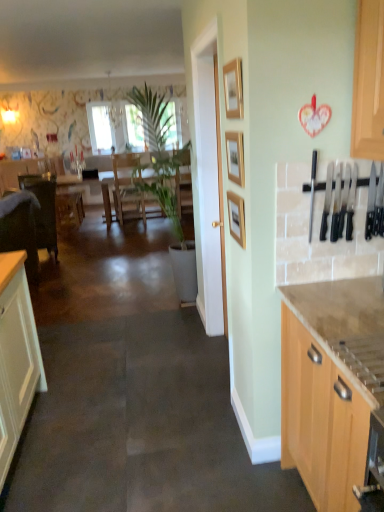
Question: Can you confirm if light wood cabinet at right is wider than wooden picture frame at center, positioned as the third picture frame in top-to-bottom order?

Choices:
 (A) no
 (B) yes

Answer: (B)

Question: Is wooden picture frame at center, the first picture frame ordered from the bottom, at the back of light wood cabinet at right?

Choices:
 (A) no
 (B) yes

Answer: (A)

Question: Is light wood cabinet at right at the right side of wooden picture frame at center, the first picture frame ordered from the bottom?

Choices:
 (A) no
 (B) yes

Answer: (B)

Question: Does light wood cabinet at right have a lesser height compared to wooden picture frame at center, positioned as the third picture frame in top-to-bottom order?

Choices:
 (A) yes
 (B) no

Answer: (B)

Question: From a real-world perspective, is light wood cabinet at right located higher than wooden picture frame at center, the first picture frame ordered from the bottom?

Choices:
 (A) no
 (B) yes

Answer: (A)

Question: In the image, is light wood cabinet at right on the left side or the right side of transparent glass window at center?

Choices:
 (A) left
 (B) right

Answer: (B)

Question: In terms of size, does light wood cabinet at right appear bigger or smaller than transparent glass window at center?

Choices:
 (A) big
 (B) small

Answer: (A)

Question: From the image's perspective, is light wood cabinet at right located above or below transparent glass window at center?

Choices:
 (A) above
 (B) below

Answer: (B)

Question: Is point (299, 333) closer or farther from the camera than point (99, 124)?

Choices:
 (A) farther
 (B) closer

Answer: (B)

Question: In the image, is light wood cabinet at right positioned in front of or behind wooden picture frame at center, the first picture frame ordered from the bottom?

Choices:
 (A) front
 (B) behind

Answer: (A)

Question: From a real-world perspective, relative to wooden picture frame at center, the first picture frame ordered from the bottom, is light wood cabinet at right vertically above or below?

Choices:
 (A) above
 (B) below

Answer: (B)

Question: From their relative heights in the image, would you say light wood cabinet at right is taller or shorter than wooden picture frame at center, positioned as the third picture frame in top-to-bottom order?

Choices:
 (A) short
 (B) tall

Answer: (B)

Question: Is light wood cabinet at right inside or outside of wooden picture frame at center, the first picture frame ordered from the bottom?

Choices:
 (A) inside
 (B) outside

Answer: (B)

Question: Considering the positions of wooden picture frame at center, positioned as the third picture frame in top-to-bottom order, and wooden table at center in the image, is wooden picture frame at center, positioned as the third picture frame in top-to-bottom order, bigger or smaller than wooden table at center?

Choices:
 (A) big
 (B) small

Answer: (B)

Question: From a real-world perspective, relative to wooden table at center, is wooden picture frame at center, the first picture frame ordered from the bottom, vertically above or below?

Choices:
 (A) below
 (B) above

Answer: (B)